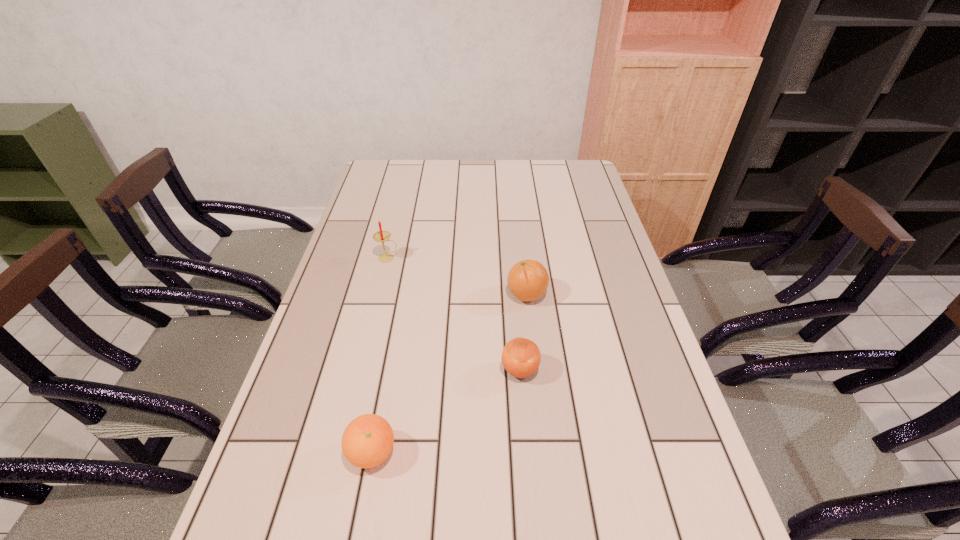
Locate an element on the screen. This screenshot has height=540, width=960. candle is located at coordinates (381, 236).

This screenshot has height=540, width=960. Identify the location of the farthest object. (381, 236).

Locate an element on the screen. the farthest orange is located at coordinates coord(528,280).

I want to click on the second nearest orange, so click(x=521, y=357).

This screenshot has width=960, height=540. What are the coordinates of `the nearest orange` in the screenshot? It's located at (x=367, y=441).

Find the location of a particular element. the nearest object is located at coordinates (367, 441).

Locate an element on the screen. This screenshot has width=960, height=540. vacant space located on the front of the farthest object is located at coordinates pos(371,331).

The image size is (960, 540). In order to click on vacant region located on the front of the third nearest object in this screenshot , I will do `click(531, 331)`.

Where is `vacant space located 0.160m on the right of the second nearest orange`? The image size is (960, 540). vacant space located 0.160m on the right of the second nearest orange is located at coordinates (607, 370).

Where is `blank space located 0.060m on the right of the nearest orange`? This screenshot has width=960, height=540. blank space located 0.060m on the right of the nearest orange is located at coordinates (426, 453).